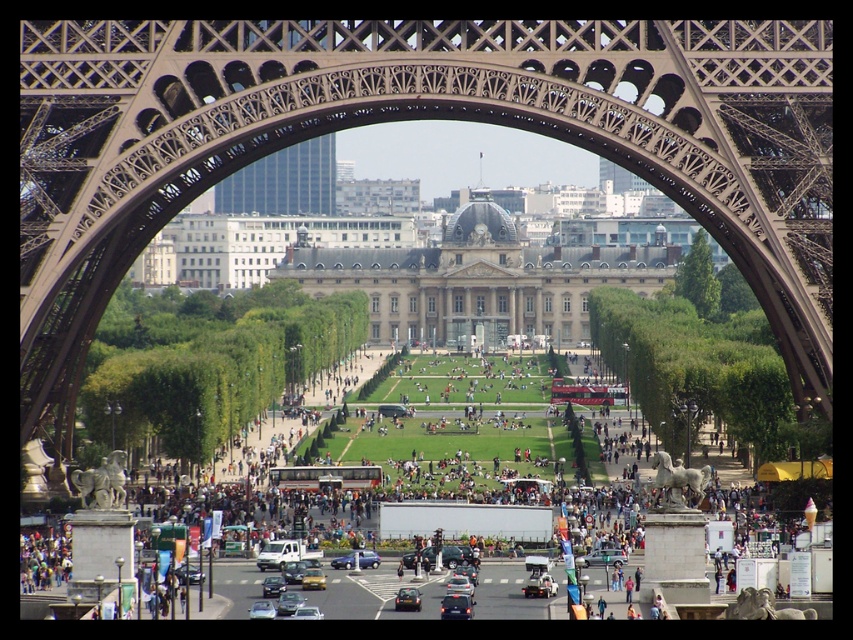
Question: Can you confirm if metallic brown eiffel tower at center is positioned to the right of metallic blue sedan at center?

Choices:
 (A) no
 (B) yes

Answer: (B)

Question: Is metallic brown eiffel tower at center positioned in front of metallic blue sedan at center?

Choices:
 (A) no
 (B) yes

Answer: (B)

Question: Does metallic brown eiffel tower at center appear on the left side of metallic blue sedan at center?

Choices:
 (A) yes
 (B) no

Answer: (B)

Question: Which point is closer to the camera?

Choices:
 (A) (347, 561)
 (B) (622, 51)

Answer: (B)

Question: Which point is closer to the camera?

Choices:
 (A) (691, 28)
 (B) (347, 566)

Answer: (A)